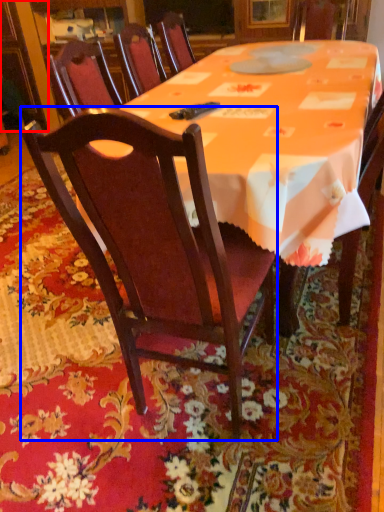
Question: Which object is further to the camera taking this photo, cabinetry (highlighted by a red box) or chair (highlighted by a blue box)?

Choices:
 (A) cabinetry
 (B) chair

Answer: (A)